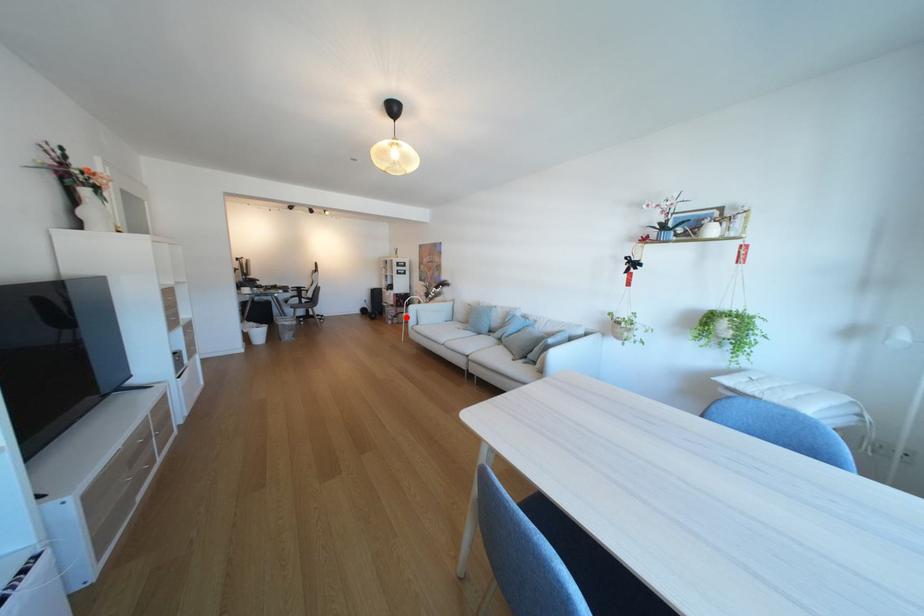
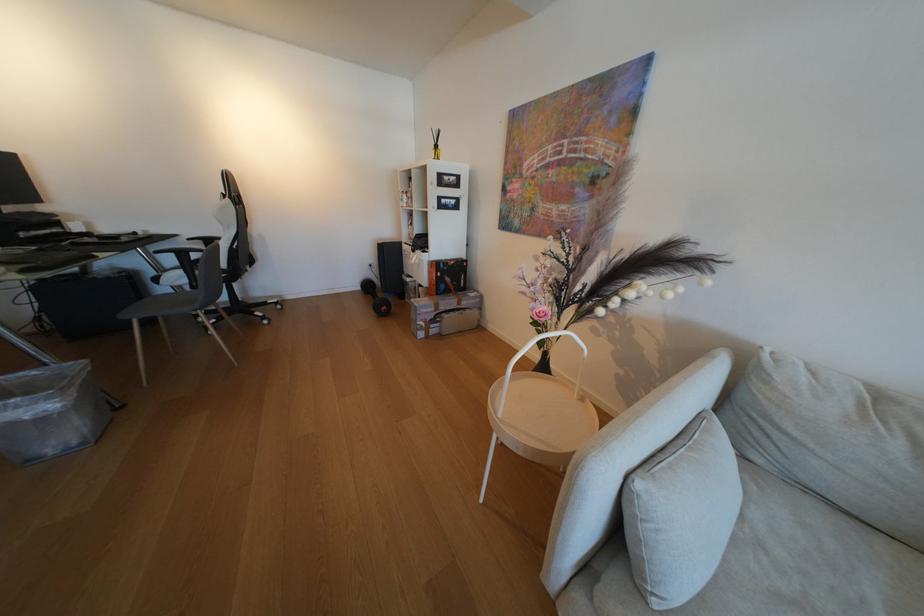
Find the pixel in the second image that matches the highlighted location in the first image.

(444, 322)